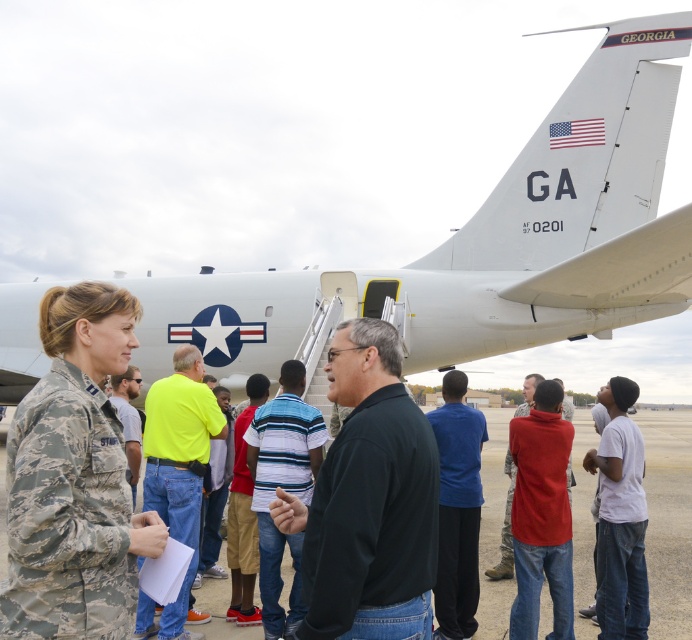
Can you confirm if black matte shirt at center is wider than camouflage uniform at center?

Incorrect, black matte shirt at center's width does not surpass camouflage uniform at center's.

Does black matte shirt at center have a greater height compared to camouflage uniform at center?

Yes, black matte shirt at center is taller than camouflage uniform at center.

I want to click on black matte shirt at center, so click(367, 500).

Describe the element at coordinates (540, 515) in the screenshot. This screenshot has width=692, height=640. I see `red matte shirt at center` at that location.

What do you see at coordinates (540, 515) in the screenshot? The image size is (692, 640). I see `red matte shirt at center` at bounding box center [540, 515].

In order to click on red matte shirt at center in this screenshot , I will do `click(540, 515)`.

Can you confirm if black matte shirt at center is positioned above blue matte shirt at center?

Yes.

Between point (390, 438) and point (471, 552), which one is positioned behind?

The point (471, 552) is behind.

Where is `black matte shirt at center`? black matte shirt at center is located at coordinates (367, 500).